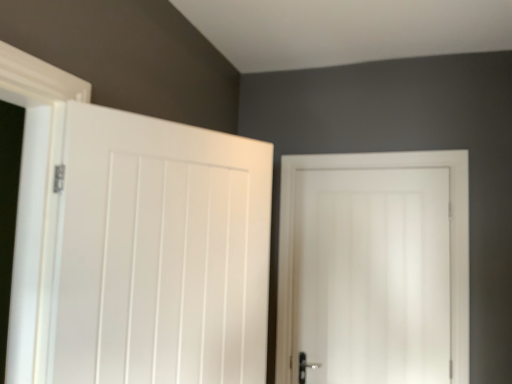
Question: Which direction should I rotate to look at white matte door at center, arranged as the 2th door when viewed from the front?

Choices:
 (A) right
 (B) left

Answer: (A)

Question: Can you confirm if white matte door at left, which is the 1th door from left to right, is smaller than white matte door at center, arranged as the 2th door when viewed from the front?

Choices:
 (A) no
 (B) yes

Answer: (A)

Question: Considering the relative sizes of white matte door at left, the second door in the back-to-front sequence, and white matte door at center, marked as the 1th door in a back-to-front arrangement, in the image provided, is white matte door at left, the second door in the back-to-front sequence, wider than white matte door at center, marked as the 1th door in a back-to-front arrangement,?

Choices:
 (A) yes
 (B) no

Answer: (A)

Question: Is the depth of white matte door at left, marked as the second door in a right-to-left arrangement, less than that of white matte door at center, arranged as the 2th door when viewed from the front?

Choices:
 (A) yes
 (B) no

Answer: (A)

Question: From a real-world perspective, is white matte door at left, the first door in the front-to-back sequence, over white matte door at center, arranged as the 2th door when viewed from the front?

Choices:
 (A) no
 (B) yes

Answer: (B)

Question: Can you confirm if white matte door at left, the second door in the back-to-front sequence, is positioned to the right of white matte door at center, marked as the second door in a left-to-right arrangement?

Choices:
 (A) yes
 (B) no

Answer: (B)

Question: Would you say white matte door at left, the first door in the front-to-back sequence, contains white matte door at center, marked as the 1th door in a back-to-front arrangement?

Choices:
 (A) yes
 (B) no

Answer: (B)

Question: From a real-world perspective, is white matte door at center, marked as the 1th door in a back-to-front arrangement, below white matte door at left, the first door in the front-to-back sequence?

Choices:
 (A) yes
 (B) no

Answer: (A)

Question: Is white matte door at center, the 1th door when ordered from right to left, facing towards white matte door at left, which is the 1th door from left to right?

Choices:
 (A) no
 (B) yes

Answer: (B)

Question: From the image's perspective, is white matte door at center, arranged as the 2th door when viewed from the front, beneath white matte door at left, marked as the second door in a right-to-left arrangement?

Choices:
 (A) yes
 (B) no

Answer: (A)

Question: Is white matte door at center, marked as the 1th door in a back-to-front arrangement, bigger than white matte door at left, marked as the second door in a right-to-left arrangement?

Choices:
 (A) no
 (B) yes

Answer: (A)

Question: Are white matte door at center, arranged as the 2th door when viewed from the front, and white matte door at left, the second door in the back-to-front sequence, far apart?

Choices:
 (A) yes
 (B) no

Answer: (B)

Question: Considering the relative sizes of white matte door at center, marked as the second door in a left-to-right arrangement, and white matte door at left, the first door in the front-to-back sequence, in the image provided, is white matte door at center, marked as the second door in a left-to-right arrangement, taller than white matte door at left, the first door in the front-to-back sequence,?

Choices:
 (A) yes
 (B) no

Answer: (A)

Question: Considering their positions, is white matte door at left, the first door in the front-to-back sequence, located in front of or behind white matte door at center, marked as the 1th door in a back-to-front arrangement?

Choices:
 (A) front
 (B) behind

Answer: (A)